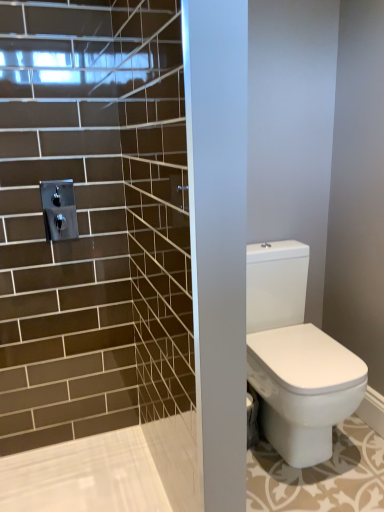
What do you see at coordinates (59, 210) in the screenshot? I see `polished chrome shower at upper left` at bounding box center [59, 210].

You are a GUI agent. You are given a task and a screenshot of the screen. Output one action in this format:
    pyautogui.click(x=<x>, y=<y>)
    Task: Click on the polished chrome shower at upper left
    
    Given the screenshot: What is the action you would take?
    pyautogui.click(x=59, y=210)

Identify the location of polished chrome shower at upper left. (59, 210).